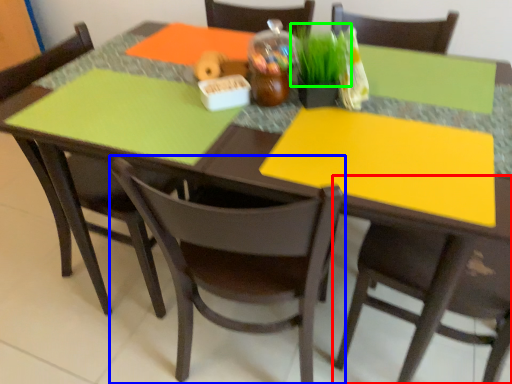
Question: Considering the real-world distances, which object is farthest from chair (highlighted by a red box)? chair (highlighted by a blue box) or grass (highlighted by a green box)?

Choices:
 (A) chair
 (B) grass

Answer: (B)